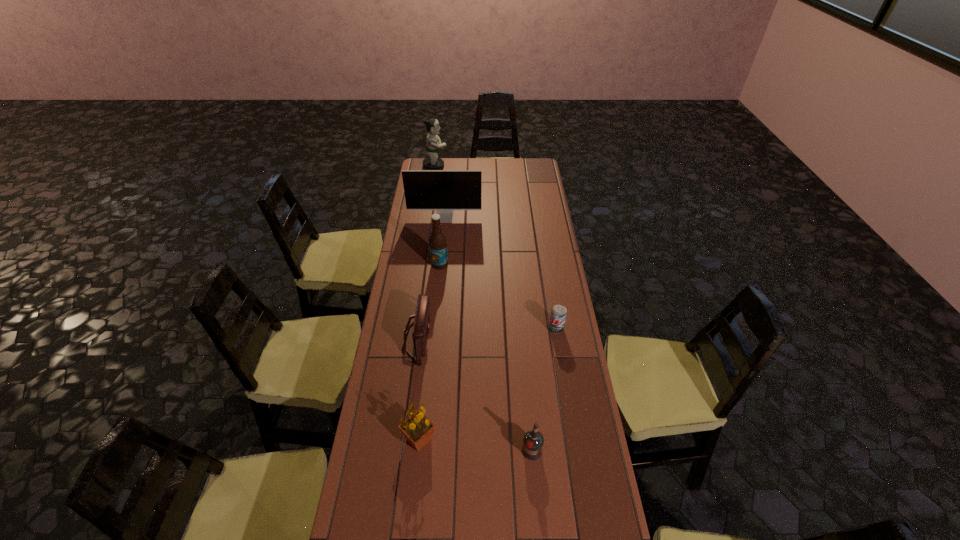
At what (x,y) coordinates should I click in order to perform the action: click on shoulder bag at the left edge. Please return your answer as a coordinate pair (x, y). This screenshot has height=540, width=960. Looking at the image, I should click on (420, 332).

Find the location of `object at the right edge`. object at the right edge is located at coordinates (558, 312).

Where is `object that is at the far left corner`? object that is at the far left corner is located at coordinates (433, 142).

Locate an element on the screen. The width and height of the screenshot is (960, 540). vacant region at the left edge is located at coordinates (413, 225).

In the image, there is a desktop. Where is `vacant space at the right edge`? Image resolution: width=960 pixels, height=540 pixels. vacant space at the right edge is located at coordinates (543, 319).

At what (x,y) coordinates should I click in order to perform the action: click on free space at the far right corner of the desktop. Please return your answer as a coordinate pair (x, y). The image size is (960, 540). Looking at the image, I should click on (543, 171).

This screenshot has height=540, width=960. What are the coordinates of `free area in between the second object from right to left and the rightmost object` in the screenshot? It's located at (544, 389).

The height and width of the screenshot is (540, 960). Find the location of `free space between the second object from right to left and the third farthest object`. free space between the second object from right to left and the third farthest object is located at coordinates (486, 357).

The image size is (960, 540). Identify the location of vacant point located between the beer bottle and the sunflower. (429, 352).

Locate an element on the screen. The image size is (960, 540). free space that is in between the sixth object from left to right and the beer can is located at coordinates coord(544,389).